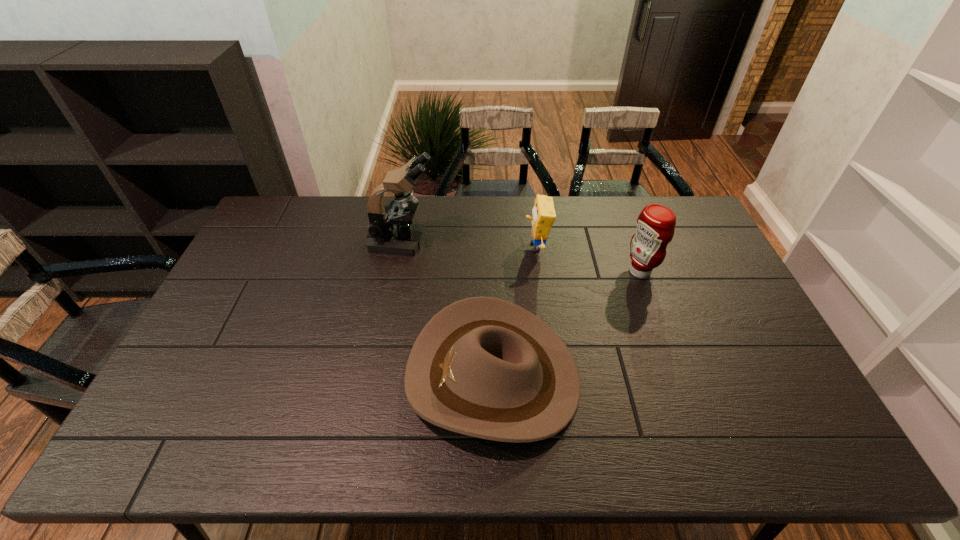
What are the coordinates of `microscope` in the screenshot? It's located at point(391,231).

The width and height of the screenshot is (960, 540). In order to click on the second tallest object in this screenshot , I will do `click(656, 223)`.

Locate an element on the screen. The image size is (960, 540). condiment is located at coordinates (656, 223).

What are the coordinates of `sponge` in the screenshot? It's located at (543, 213).

Where is `cowboy hat`? The width and height of the screenshot is (960, 540). cowboy hat is located at coordinates (484, 367).

Image resolution: width=960 pixels, height=540 pixels. Find the location of `vacant region located on the left of the tallest object`. vacant region located on the left of the tallest object is located at coordinates (309, 241).

You are a GUI agent. You are given a task and a screenshot of the screen. Output one action in this format:
    pyautogui.click(x=<x>, y=<y>)
    Task: Click on the vacant space located on the left of the condiment
    The width and height of the screenshot is (960, 540).
    Given the screenshot: What is the action you would take?
    pyautogui.click(x=573, y=271)

The height and width of the screenshot is (540, 960). Identify the location of free space located 0.260m on the face of the sponge. (448, 247).

Identify the location of vacant space positioned on the face of the sponge. The height and width of the screenshot is (540, 960). (483, 247).

The image size is (960, 540). Find the location of `vacant space situated 0.310m on the face of the sponge`. vacant space situated 0.310m on the face of the sponge is located at coordinates (434, 247).